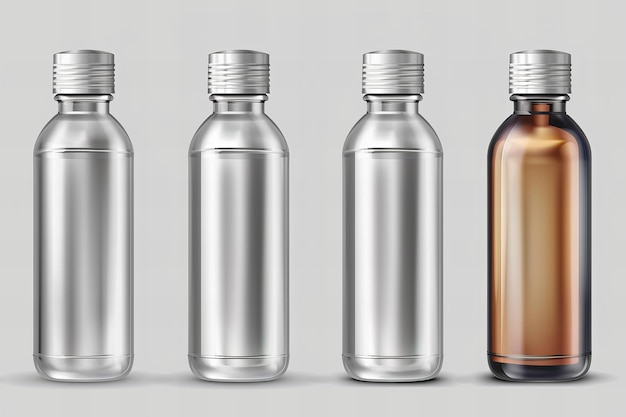
Find the location of a particular element. The width and height of the screenshot is (626, 417). middle bottle is located at coordinates (540, 261), (390, 252), (238, 243), (80, 240).